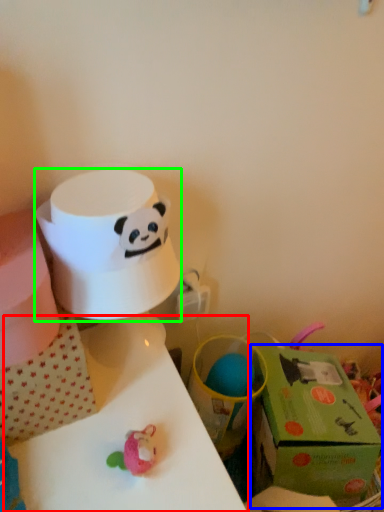
Question: Which object is positioned closest to table (highlighted by a red box)? Select from gift box (highlighted by a blue box) and paper towel (highlighted by a green box).

Choices:
 (A) gift box
 (B) paper towel

Answer: (B)